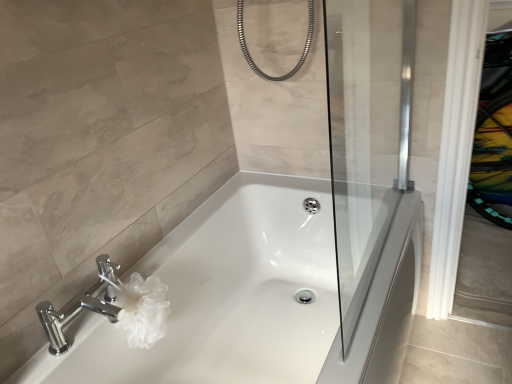
Question: From a real-world perspective, is transparent glass screen door at center positioned above or below white glossy bathtub at center?

Choices:
 (A) above
 (B) below

Answer: (A)

Question: Would you say transparent glass screen door at center is to the left or to the right of white glossy bathtub at center in the picture?

Choices:
 (A) right
 (B) left

Answer: (A)

Question: Estimate the real-world distances between objects in this image. Which object is closer to the transparent glass screen door at center?

Choices:
 (A) white glossy bathtub at center
 (B) chrome/metallic faucet at lower left

Answer: (A)

Question: Which object is positioned closest to the chrome/metallic faucet at lower left?

Choices:
 (A) transparent glass screen door at center
 (B) white glossy bathtub at center

Answer: (B)